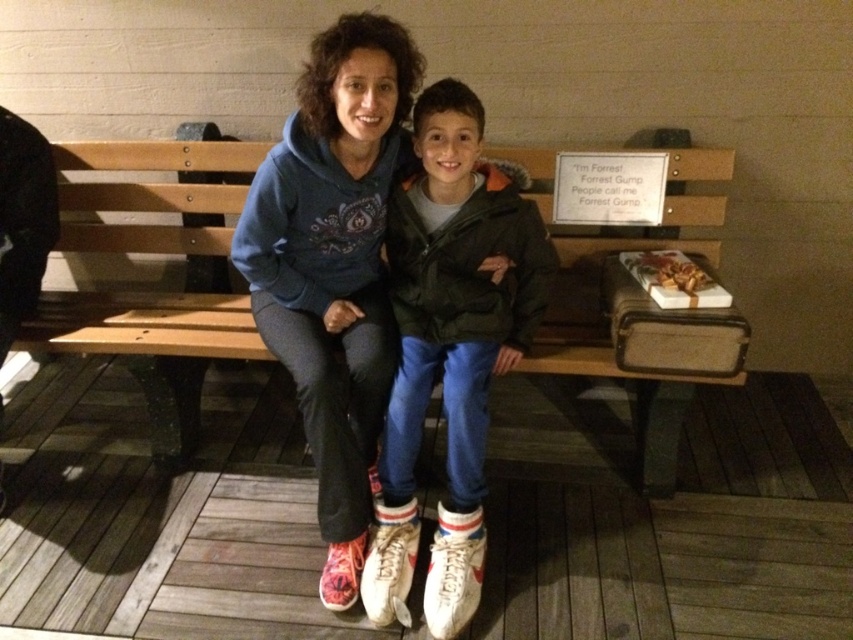
Question: Is wooden bench at center thinner than white leather shoes at center?

Choices:
 (A) yes
 (B) no

Answer: (B)

Question: Which is nearer to the wooden bench at center?

Choices:
 (A) white leather shoes at center
 (B) matte blue hoodie at center

Answer: (B)

Question: Can you confirm if wooden bench at center is positioned below matte blue hoodie at center?

Choices:
 (A) yes
 (B) no

Answer: (B)

Question: Is wooden bench at center to the right of white leather shoes at center from the viewer's perspective?

Choices:
 (A) no
 (B) yes

Answer: (A)

Question: Which point is closer to the camera?

Choices:
 (A) (318, 77)
 (B) (482, 429)

Answer: (A)

Question: Considering the real-world distances, which object is farthest from the wooden bench at center?

Choices:
 (A) white leather shoes at center
 (B) matte blue hoodie at center

Answer: (A)